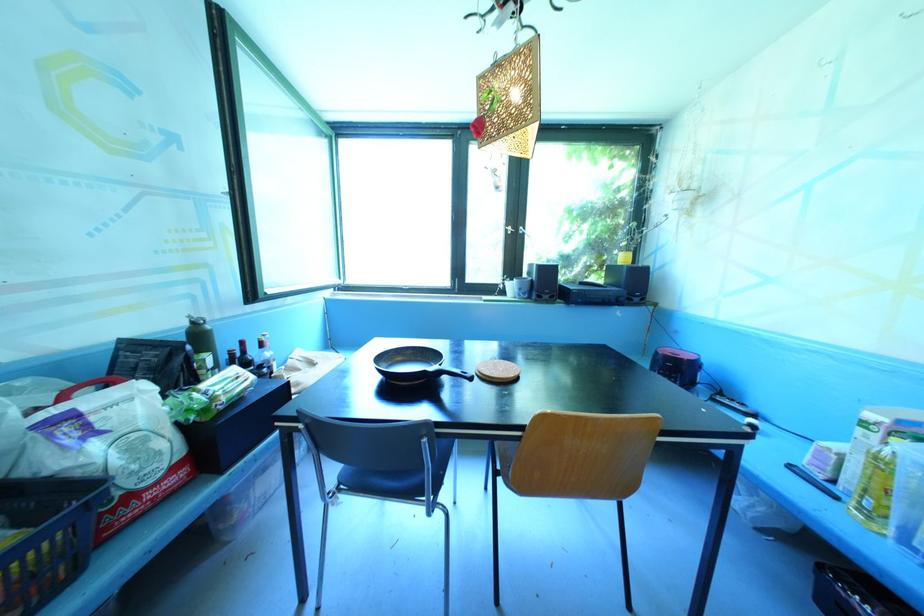
Find where to lift the clear glass bottle. Please return your answer as a coordinate pair (x, y).

(265, 355)